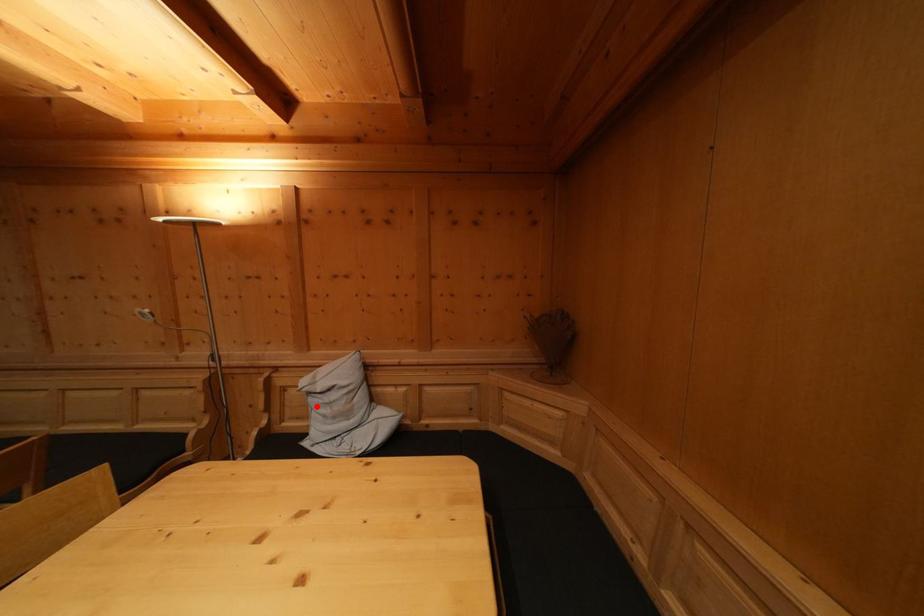
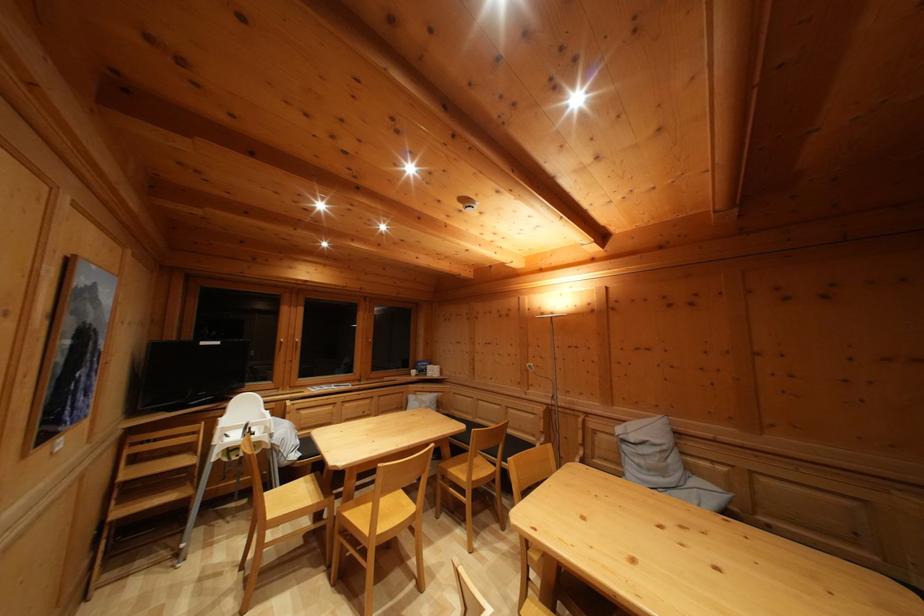
The point at the highlighted location is marked in the first image. Where is the corresponding point in the second image?

(629, 454)